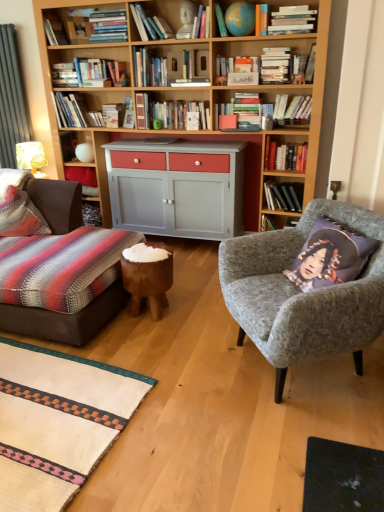
Question: Can purple fabric cushion at right be found inside hardcover books at upper center, which ranks as the 11th book in left-to-right order?

Choices:
 (A) yes
 (B) no

Answer: (B)

Question: Is hardcover books at upper center, which is the fifth book in right-to-left order, far away from purple fabric cushion at right?

Choices:
 (A) yes
 (B) no

Answer: (A)

Question: Is hardcover books at upper center, which ranks as the 11th book in left-to-right order, completely or partially outside of purple fabric cushion at right?

Choices:
 (A) yes
 (B) no

Answer: (A)

Question: Is hardcover books at upper center, which is the fifth book in right-to-left order, at the right side of purple fabric cushion at right?

Choices:
 (A) no
 (B) yes

Answer: (A)

Question: Is hardcover books at upper center, which ranks as the 11th book in left-to-right order, oriented towards purple fabric cushion at right?

Choices:
 (A) yes
 (B) no

Answer: (B)

Question: Can you confirm if hardcover books at upper center, which is the fifth book in right-to-left order, is smaller than purple fabric cushion at right?

Choices:
 (A) no
 (B) yes

Answer: (B)

Question: Would you say purple fabric cushion at right is a long distance from matte blue globe at upper center, which is counted as the 8th book, starting from the left?

Choices:
 (A) no
 (B) yes

Answer: (B)

Question: Considering the relative sizes of purple fabric cushion at right and matte blue globe at upper center, which is counted as the 8th book, starting from the left, in the image provided, is purple fabric cushion at right wider than matte blue globe at upper center, which is counted as the 8th book, starting from the left,?

Choices:
 (A) no
 (B) yes

Answer: (B)

Question: From a real-world perspective, is purple fabric cushion at right located higher than matte blue globe at upper center, which is counted as the 8th book, starting from the left?

Choices:
 (A) no
 (B) yes

Answer: (A)

Question: From the image's perspective, is purple fabric cushion at right above matte blue globe at upper center, which is counted as the 8th book, starting from the left?

Choices:
 (A) yes
 (B) no

Answer: (B)

Question: Is matte blue globe at upper center, which is counted as the 8th book, starting from the left, inside purple fabric cushion at right?

Choices:
 (A) no
 (B) yes

Answer: (A)

Question: Can you confirm if purple fabric cushion at right is smaller than matte blue globe at upper center, positioned as the eighth book in right-to-left order?

Choices:
 (A) no
 (B) yes

Answer: (A)

Question: Is striped fabric pillow at left not near hardcover book at upper center, placed as the 9th book when sorted from right to left?

Choices:
 (A) no
 (B) yes

Answer: (B)